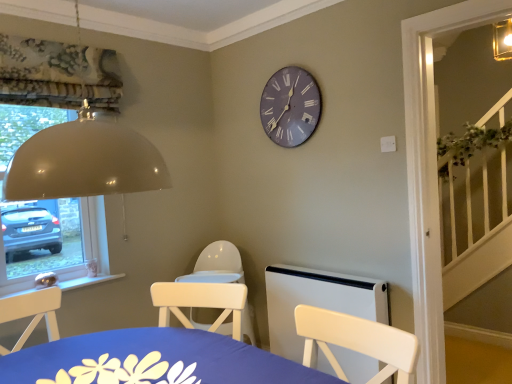
Question: From a real-world perspective, is white plastic radiator at lower center physically located above or below matte gray clock at upper center?

Choices:
 (A) above
 (B) below

Answer: (B)

Question: Do you think white plastic radiator at lower center is within matte gray clock at upper center, or outside of it?

Choices:
 (A) inside
 (B) outside

Answer: (B)

Question: Considering the real-world distances, which object is closest to the blue fabric table at lower center?

Choices:
 (A) white plastic radiator at lower center
 (B) matte gray clock at upper center

Answer: (A)

Question: Which object is positioned farthest from the blue fabric table at lower center?

Choices:
 (A) white plastic radiator at lower center
 (B) matte gray clock at upper center

Answer: (B)